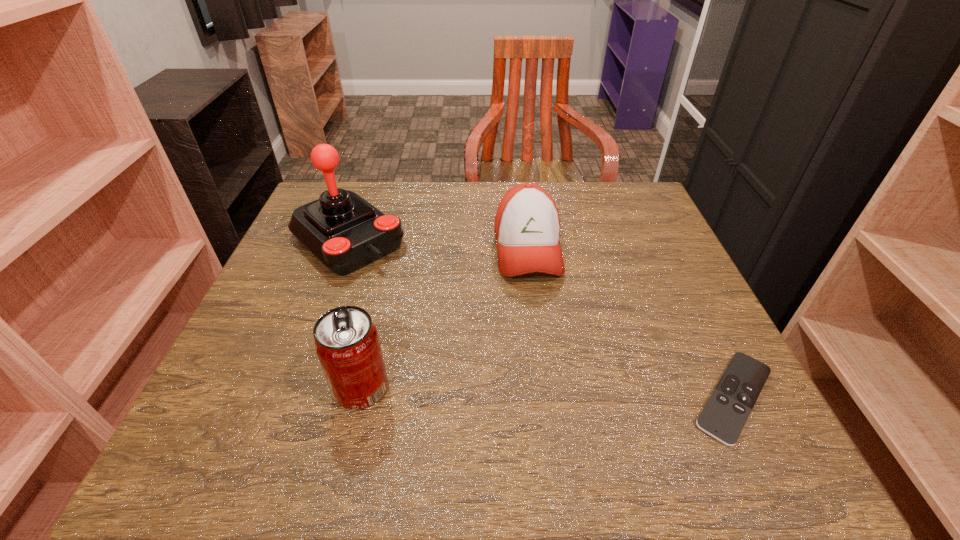
Locate an element on the screen. This screenshot has height=540, width=960. vacant space located on the front-facing side of the baseball cap is located at coordinates (546, 358).

The height and width of the screenshot is (540, 960). What are the coordinates of `vacant space situated on the base of the joystick` in the screenshot? It's located at (482, 357).

At what (x,y) coordinates should I click in order to perform the action: click on vacant space located on the base of the joystick. Please return your answer as a coordinate pair (x, y). The image size is (960, 540). Looking at the image, I should click on (486, 361).

Where is `free space located on the base of the joystick`? free space located on the base of the joystick is located at coordinates (493, 367).

Locate an element on the screen. The width and height of the screenshot is (960, 540). baseball cap at the far edge is located at coordinates (527, 226).

I want to click on joystick situated at the far edge, so click(345, 232).

Identify the location of pop soda that is at the near edge. Image resolution: width=960 pixels, height=540 pixels. (346, 341).

You are a GUI agent. You are given a task and a screenshot of the screen. Output one action in this format:
    pyautogui.click(x=<x>, y=<y>)
    Task: Click on the remote control positioned at the near edge
    This screenshot has width=960, height=540.
    Given the screenshot: What is the action you would take?
    pyautogui.click(x=723, y=417)

Locate an element on the screen. object present at the left edge is located at coordinates (345, 232).

Identify the location of object present at the right edge. (723, 417).